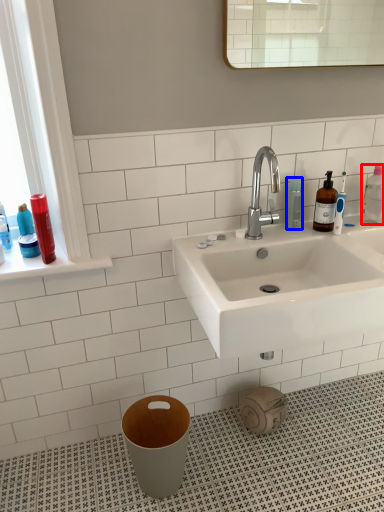
Question: Which object appears farthest to the camera in this image, cleaning product (highlighted by a red box) or mouthwash (highlighted by a blue box)?

Choices:
 (A) cleaning product
 (B) mouthwash

Answer: (A)